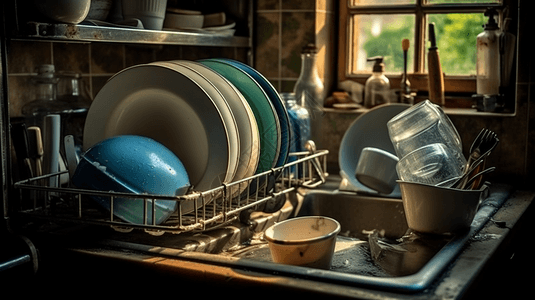
You are a GUI agent. You are given a task and a screenshot of the screen. Output one action in this format:
    pyautogui.click(x=<x>, y=<y>)
    Task: Click on the plates
    The height and width of the screenshot is (300, 535).
    Given the screenshot: What is the action you would take?
    pyautogui.click(x=197, y=99), pyautogui.click(x=214, y=96), pyautogui.click(x=229, y=97), pyautogui.click(x=249, y=106), pyautogui.click(x=262, y=104), pyautogui.click(x=274, y=102)